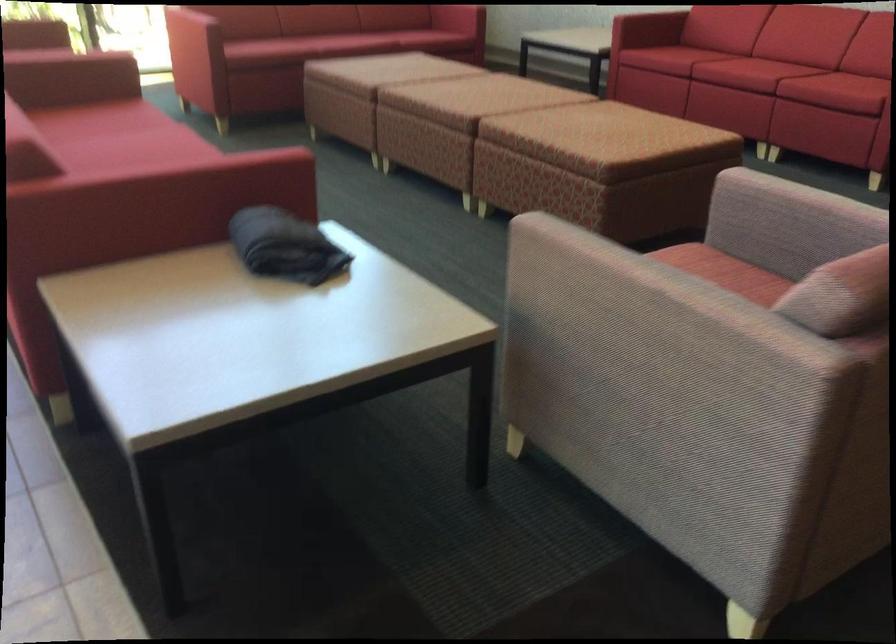
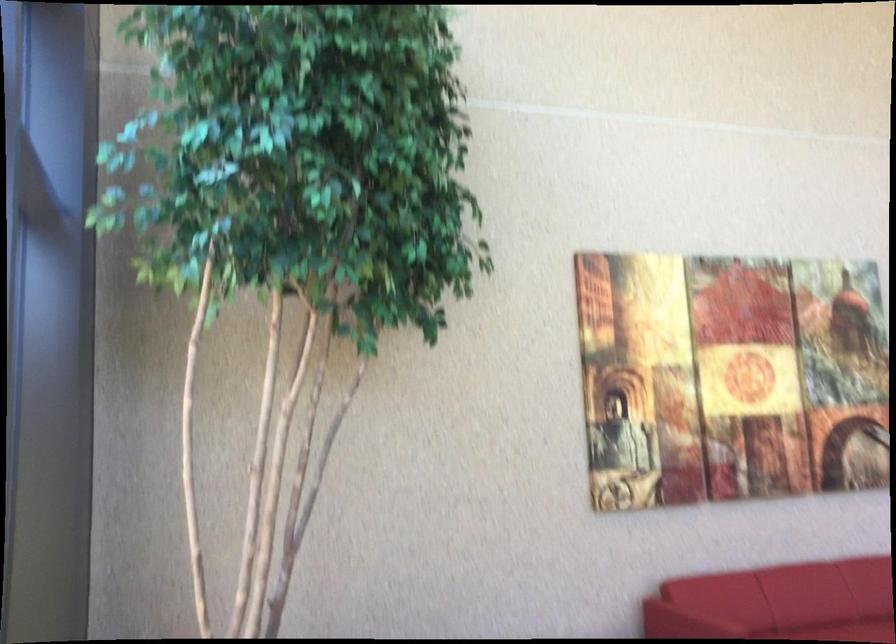
First-person continuous shooting, in which direction is the camera rotating?

The rotation direction of the camera is right-down.